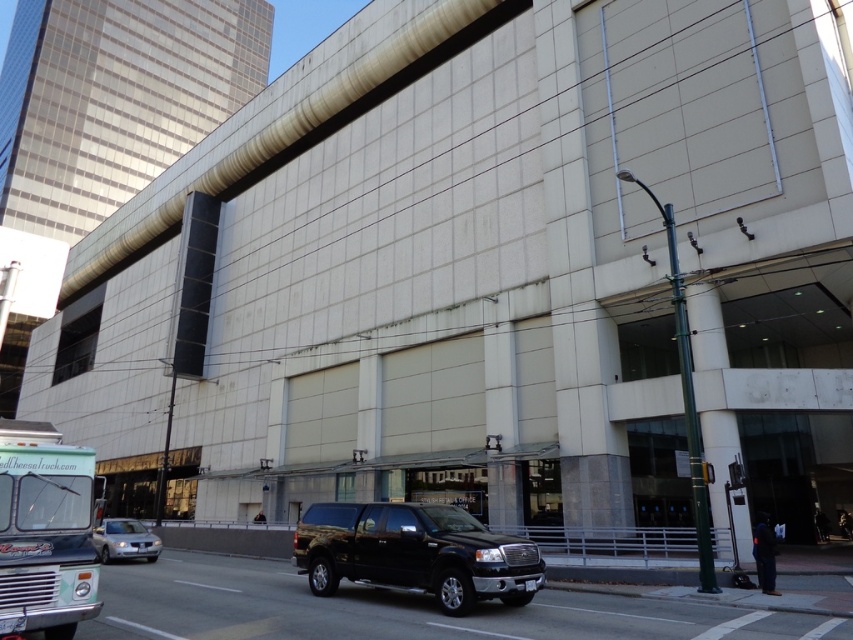
Question: Estimate the real-world distances between objects in this image. Which object is closer to the black metallic suv at center?

Choices:
 (A) teal matte bus at lower left
 (B) silver metallic sedan at lower left

Answer: (B)

Question: Can you confirm if black metallic suv at center is bigger than teal matte bus at lower left?

Choices:
 (A) no
 (B) yes

Answer: (A)

Question: Which object is the closest to the teal matte bus at lower left?

Choices:
 (A) black metallic suv at center
 (B) silver metallic sedan at lower left

Answer: (B)

Question: Is black metallic suv at center behind silver metallic sedan at lower left?

Choices:
 (A) yes
 (B) no

Answer: (A)

Question: Which point is farther to the camera?

Choices:
 (A) teal matte bus at lower left
 (B) black metallic suv at center

Answer: (B)

Question: Can you confirm if teal matte bus at lower left is bigger than silver metallic sedan at lower left?

Choices:
 (A) no
 (B) yes

Answer: (B)